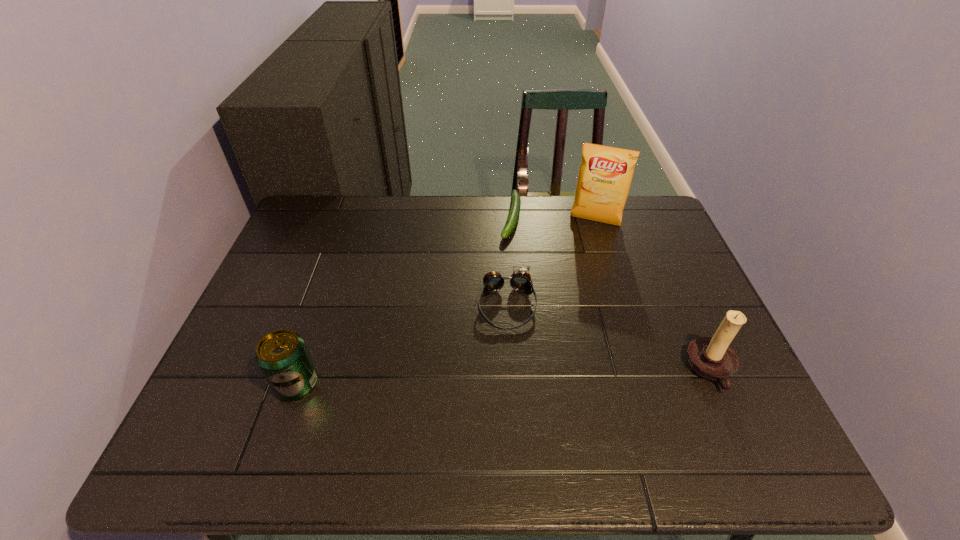
Locate an element on the screen. free space between the fourth shortest object and the third shortest object is located at coordinates (504, 377).

Locate an element on the screen. Image resolution: width=960 pixels, height=540 pixels. free point between the leftmost object and the zucchini is located at coordinates (404, 301).

Where is `unoccupied area between the zucchini and the second tallest object`? The height and width of the screenshot is (540, 960). unoccupied area between the zucchini and the second tallest object is located at coordinates (611, 294).

Image resolution: width=960 pixels, height=540 pixels. I want to click on vacant region between the leftmost object and the crisp (potato chip), so click(x=445, y=303).

Identify the location of free space between the zucchini and the fourth tallest object. (509, 261).

Where is `vacant space that is in between the third shortest object and the zucchini`? vacant space that is in between the third shortest object and the zucchini is located at coordinates (404, 301).

Where is `vacant region between the third farthest object and the beer can`? The image size is (960, 540). vacant region between the third farthest object and the beer can is located at coordinates (402, 345).

The image size is (960, 540). Identify the location of free spot between the fourth tallest object and the shortest object. (x=509, y=261).

You are a GUI agent. You are given a task and a screenshot of the screen. Output one action in this format:
    pyautogui.click(x=<x>, y=<y>)
    Task: Click on the object that ranks as the second closest to the second object from right to left
    This screenshot has width=960, height=540.
    Given the screenshot: What is the action you would take?
    pyautogui.click(x=520, y=280)

Identify which object is the third closest to the leftmost object. Please provide its 2D coordinates. Your answer should be formatted as a tuple, i.e. [(x, y)], where the tuple contains the x and y coordinates of a point satisfying the conditions above.

[(605, 175)]